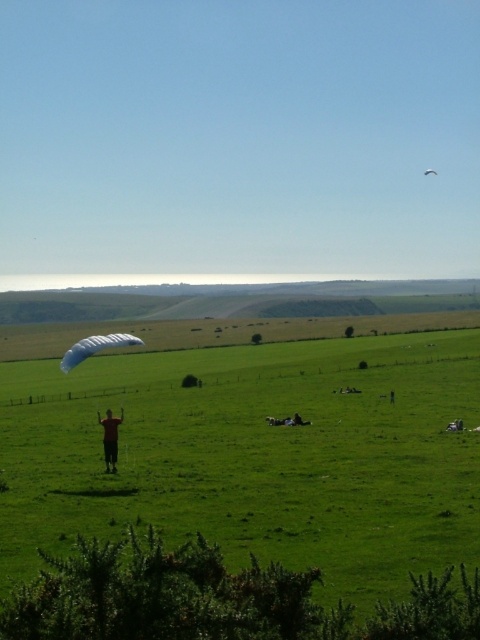
You are planning to take a photo of the white matte parachute at lower left and the white fabric parachute at upper center. Which one should you focus on if you want to capture the larger object in your shot?

The white matte parachute at lower left should be focused on because its width is larger than the white fabric parachute at upper center.

You are a photographer trying to capture both the white matte parachute at lower left and the white fabric parachute at upper center in a single frame. Based on their positions, which parachute should you adjust your camera focus to first to ensure both are in the shot?

The white matte parachute at lower left is positioned on the left side of white fabric parachute at upper center. To capture both in a single frame, you should focus on the white fabric parachute at upper center first since it is higher up and the lower left one is to its left, ensuring the camera captures the entire scene from the upper to lower left areas.